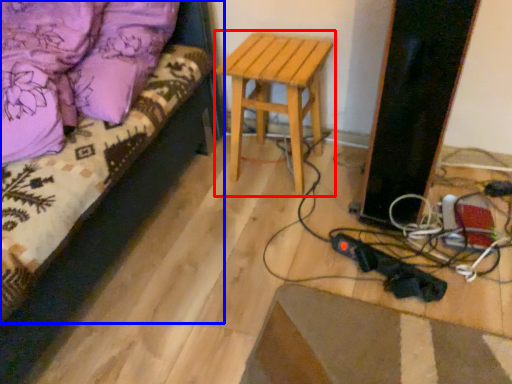
Question: Among these objects, which one is nearest to the camera, stool (highlighted by a red box) or furniture (highlighted by a blue box)?

Choices:
 (A) stool
 (B) furniture

Answer: (B)